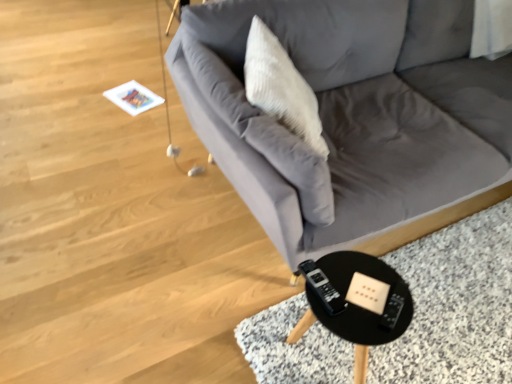
Locate an element on the screen. vacant space situated on the left part of gray fabric couch at center is located at coordinates (98, 167).